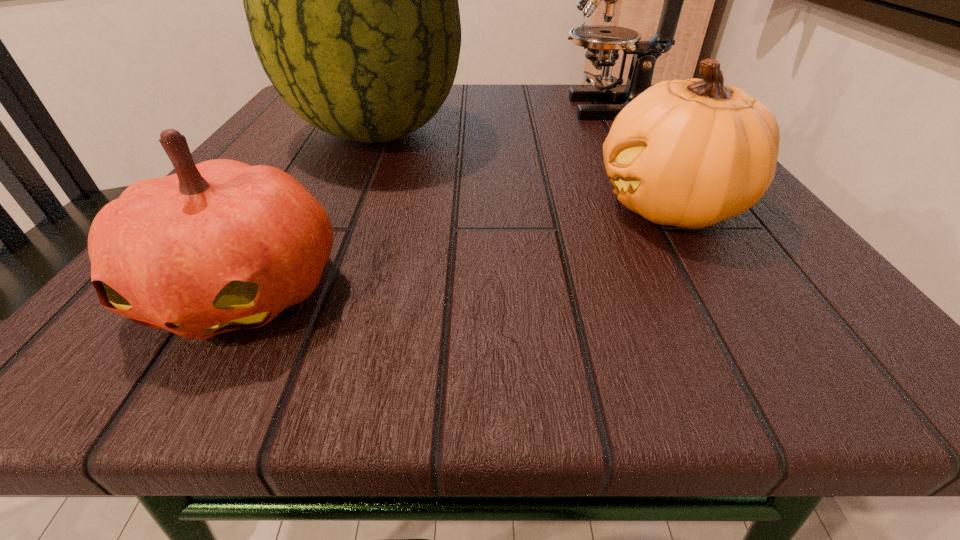
Identify the location of microscope. The height and width of the screenshot is (540, 960). (603, 42).

Where is `watermelon`? This screenshot has width=960, height=540. watermelon is located at coordinates (351, 0).

Find the location of a particular element. The width and height of the screenshot is (960, 540). the right pumpkin is located at coordinates (690, 153).

Identify the location of the left pumpkin. This screenshot has height=540, width=960. (218, 246).

Where is `vacant area situated at the eyepiece of the microscope`? vacant area situated at the eyepiece of the microscope is located at coordinates (427, 108).

Find the location of a particular element. The height and width of the screenshot is (540, 960). free space located 0.240m at the eyepiece of the microscope is located at coordinates (437, 108).

At what (x,y) coordinates should I click in order to perform the action: click on vacant space located 0.280m at the eyepiece of the microscope. Please return your answer as a coordinate pair (x, y). The height and width of the screenshot is (540, 960). Looking at the image, I should click on (417, 108).

Locate an element on the screen. vacant space located on the right of the watermelon is located at coordinates (662, 132).

Identify the location of vacant region located 0.380m on the front face of the right pumpkin. The height and width of the screenshot is (540, 960). (312, 207).

Where is `vacant space situated on the front face of the right pumpkin`? vacant space situated on the front face of the right pumpkin is located at coordinates (312, 207).